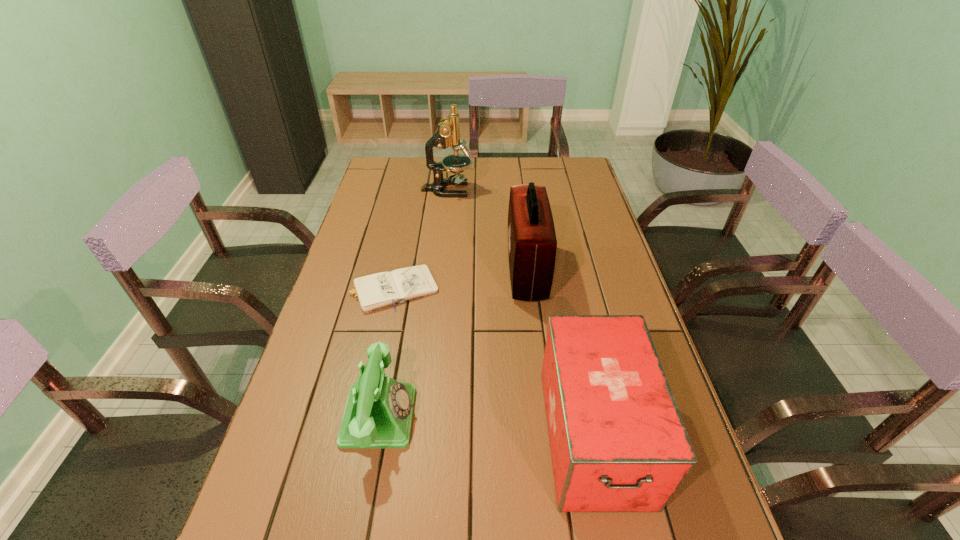
At what (x,y) coordinates should I click in order to perform the action: click on vacant space located 0.290m on the side of the farther first-aid kit with the cross symbol. Please return your answer as a coordinate pair (x, y). This screenshot has height=540, width=960. Looking at the image, I should click on (410, 271).

This screenshot has width=960, height=540. In order to click on free region located on the side of the farther first-aid kit with the cross symbol in this screenshot , I will do `click(474, 271)`.

Locate an element on the screen. free space located 0.230m on the dial of the telephone is located at coordinates (520, 416).

Find the location of `free space located on the back of the shortest object`. free space located on the back of the shortest object is located at coordinates (403, 237).

At what (x,y) coordinates should I click in order to perform the action: click on object located in the far edge section of the desktop. Please return your answer as a coordinate pair (x, y). The width and height of the screenshot is (960, 540). Looking at the image, I should click on (448, 134).

Identify the location of telephone present at the left edge. The height and width of the screenshot is (540, 960). [378, 414].

Where is `notebook that is at the left edge`? notebook that is at the left edge is located at coordinates (375, 291).

I want to click on object that is positioned at the right edge, so click(x=617, y=440).

Where is `free spot at the far edge of the desktop`? The height and width of the screenshot is (540, 960). free spot at the far edge of the desktop is located at coordinates (480, 162).

Identify the location of vacant area at the left edge of the desktop. This screenshot has width=960, height=540. (401, 197).